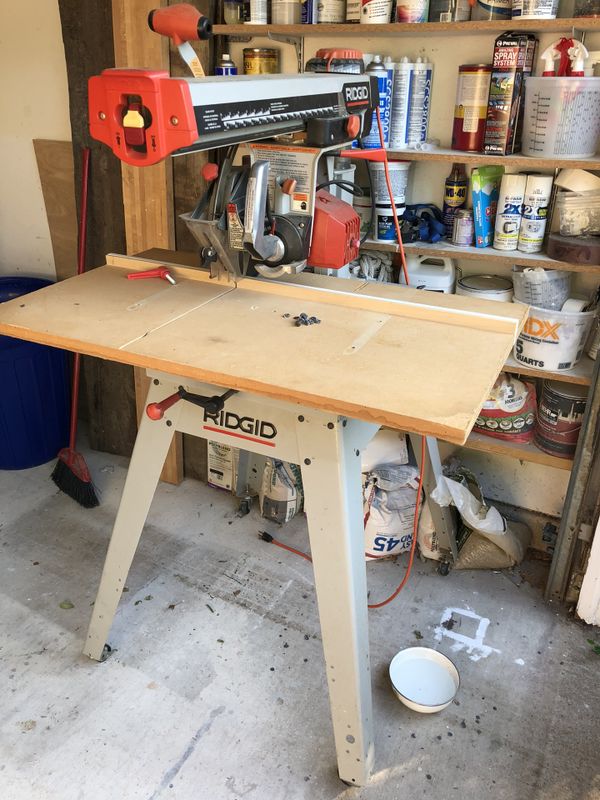
Help me find what you plug in to the wall socket in the image by pointing to them. Your answer should be formatted as a list of tuples, i.e. [(x1, y1), (x2, y2), ...], where each tuple contains the x and y coordinates of a point satisfying the conditions above.

[(264, 538)]